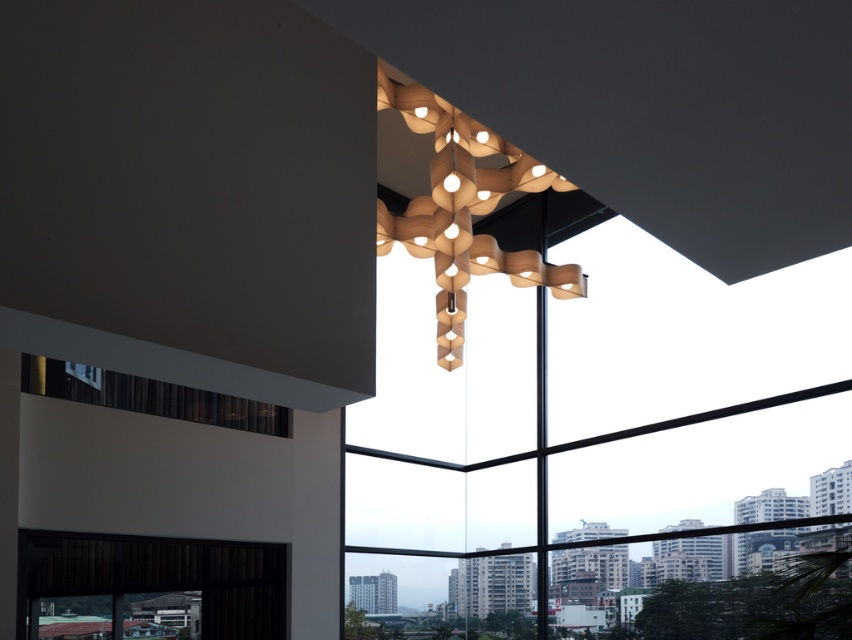
Question: Which point is farther from the camera taking this photo?

Choices:
 (A) (200, 397)
 (B) (504, 179)

Answer: (A)

Question: Is wooden chandelier at upper center to the right of black fabric window at lower left from the viewer's perspective?

Choices:
 (A) yes
 (B) no

Answer: (A)

Question: Is wooden chandelier at upper center further to camera compared to black fabric window at lower left?

Choices:
 (A) yes
 (B) no

Answer: (B)

Question: Is wooden chandelier at upper center to the left of black fabric window at lower left from the viewer's perspective?

Choices:
 (A) yes
 (B) no

Answer: (B)